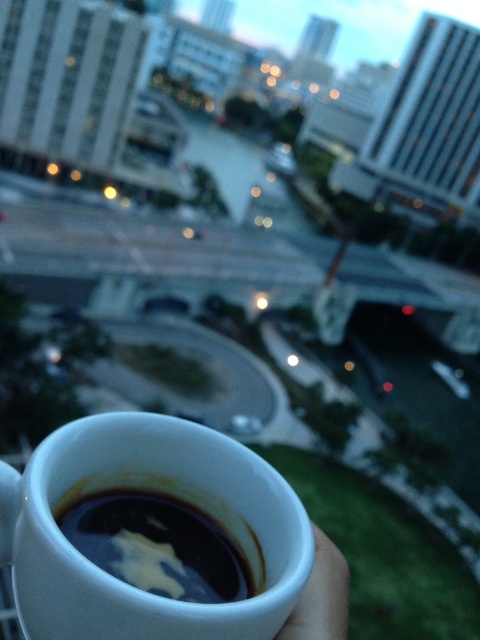
Question: Is the position of white glossy mug at lower center less distant than that of black glossy coffee cup at lower center?

Choices:
 (A) yes
 (B) no

Answer: (A)

Question: Among these points, which one is nearest to the camera?

Choices:
 (A) (159, 464)
 (B) (202, 547)

Answer: (B)

Question: Is white glossy mug at lower center thinner than black glossy coffee cup at lower center?

Choices:
 (A) no
 (B) yes

Answer: (A)

Question: In this image, where is white glossy mug at lower center located relative to black glossy coffee cup at lower center?

Choices:
 (A) left
 (B) right

Answer: (A)